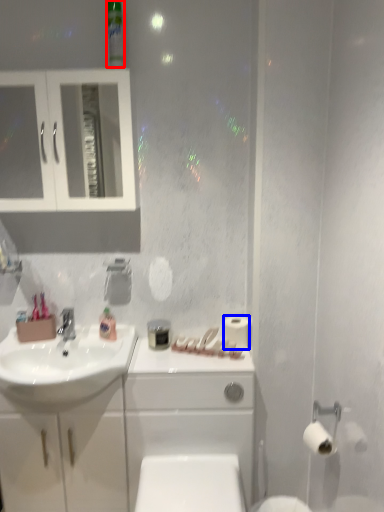
Question: Which object appears closest to the camera in this image, mouthwash (highlighted by a red box) or toilet paper (highlighted by a blue box)?

Choices:
 (A) mouthwash
 (B) toilet paper

Answer: (A)